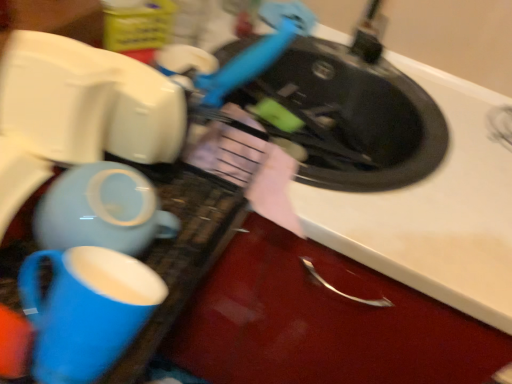
Question: Considering the relative sizes of matte ceramic teapot at lower left and white matte sink at upper right in the image provided, is matte ceramic teapot at lower left bigger than white matte sink at upper right?

Choices:
 (A) no
 (B) yes

Answer: (A)

Question: Is matte ceramic teapot at lower left wider than white matte sink at upper right?

Choices:
 (A) yes
 (B) no

Answer: (B)

Question: Is white matte sink at upper right a part of matte ceramic teapot at lower left?

Choices:
 (A) no
 (B) yes

Answer: (A)

Question: From a real-world perspective, is matte ceramic teapot at lower left beneath white matte sink at upper right?

Choices:
 (A) no
 (B) yes

Answer: (A)

Question: Is matte ceramic teapot at lower left not within white matte sink at upper right?

Choices:
 (A) yes
 (B) no

Answer: (A)

Question: Does matte ceramic teapot at lower left have a lesser width compared to white matte sink at upper right?

Choices:
 (A) yes
 (B) no

Answer: (A)

Question: From the image's perspective, is matte ceramic mug at lower left located beneath matte ceramic teapot at lower left?

Choices:
 (A) no
 (B) yes

Answer: (B)

Question: Is matte ceramic mug at lower left smaller than matte ceramic teapot at lower left?

Choices:
 (A) no
 (B) yes

Answer: (B)

Question: Is matte ceramic mug at lower left positioned with its back to matte ceramic teapot at lower left?

Choices:
 (A) yes
 (B) no

Answer: (B)

Question: From the image's perspective, does matte ceramic mug at lower left appear higher than matte ceramic teapot at lower left?

Choices:
 (A) yes
 (B) no

Answer: (B)

Question: Is matte ceramic mug at lower left oriented towards matte ceramic teapot at lower left?

Choices:
 (A) yes
 (B) no

Answer: (B)

Question: Does matte ceramic mug at lower left appear on the right side of matte ceramic teapot at lower left?

Choices:
 (A) no
 (B) yes

Answer: (B)

Question: Can we say white matte sink at upper right lies outside matte ceramic mug at lower left?

Choices:
 (A) yes
 (B) no

Answer: (A)